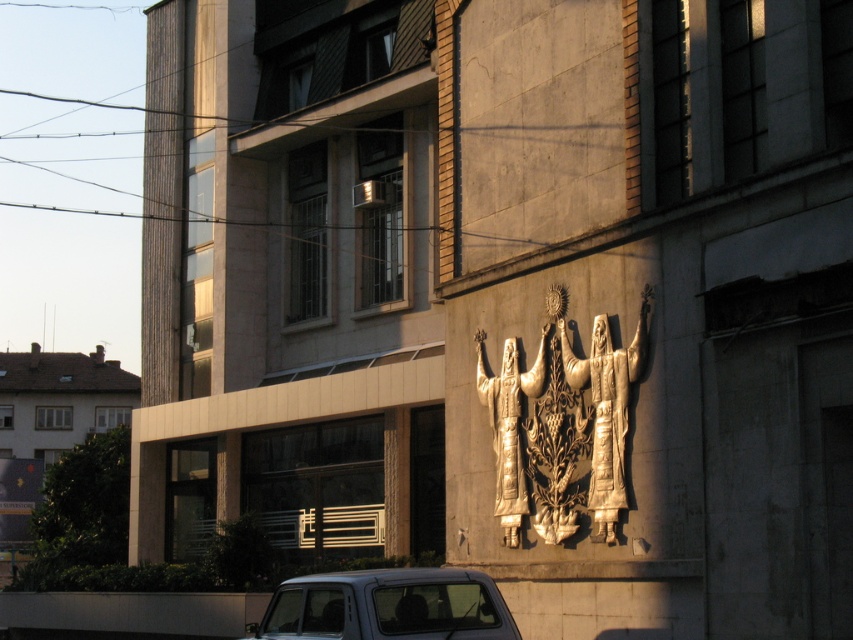
Does metallic silver car at lower center have a greater height compared to gold textured relief at center?

In fact, metallic silver car at lower center may be shorter than gold textured relief at center.

Is metallic silver car at lower center thinner than gold textured relief at center?

No, metallic silver car at lower center is not thinner than gold textured relief at center.

This screenshot has width=853, height=640. What do you see at coordinates (387, 605) in the screenshot? I see `metallic silver car at lower center` at bounding box center [387, 605].

Find the location of a particular element. metallic silver car at lower center is located at coordinates (387, 605).

Is point (360, 618) more distant than point (498, 496)?

No, it is in front of (498, 496).

The height and width of the screenshot is (640, 853). Describe the element at coordinates (387, 605) in the screenshot. I see `metallic silver car at lower center` at that location.

Locate an element on the screen. This screenshot has width=853, height=640. metallic silver car at lower center is located at coordinates (387, 605).

Where is `metallic silver car at lower center`? The image size is (853, 640). metallic silver car at lower center is located at coordinates (387, 605).

Can you confirm if gold textured relief at center is wider than gold textured statue at center?

Yes.

Can you confirm if gold textured relief at center is positioned below gold textured statue at center?

Incorrect, gold textured relief at center is not positioned below gold textured statue at center.

Does point (592, 385) come in front of point (544, 369)?

Yes, it is.

Identify the location of gold textured relief at center. [x=606, y=404].